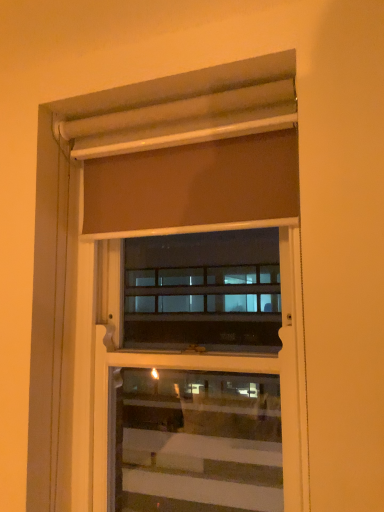
Question: Should I look upward or downward to see matte brown curtain at upper center?

Choices:
 (A) down
 (B) up

Answer: (B)

Question: Can you confirm if matte brown roller shade at upper center is wider than matte brown curtain at upper center?

Choices:
 (A) yes
 (B) no

Answer: (B)

Question: Is matte brown roller shade at upper center surrounding matte brown curtain at upper center?

Choices:
 (A) yes
 (B) no

Answer: (B)

Question: From a real-world perspective, is matte brown roller shade at upper center located higher than matte brown curtain at upper center?

Choices:
 (A) no
 (B) yes

Answer: (A)

Question: From the image's perspective, is matte brown roller shade at upper center above matte brown curtain at upper center?

Choices:
 (A) yes
 (B) no

Answer: (B)

Question: Does matte brown roller shade at upper center have a lesser width compared to matte brown curtain at upper center?

Choices:
 (A) no
 (B) yes

Answer: (B)

Question: Is matte brown roller shade at upper center facing towards matte brown curtain at upper center?

Choices:
 (A) yes
 (B) no

Answer: (A)

Question: Considering the relative sizes of matte brown curtain at upper center and matte brown roller shade at upper center in the image provided, is matte brown curtain at upper center thinner than matte brown roller shade at upper center?

Choices:
 (A) yes
 (B) no

Answer: (B)

Question: Is matte brown curtain at upper center facing towards matte brown roller shade at upper center?

Choices:
 (A) yes
 (B) no

Answer: (B)

Question: Is matte brown curtain at upper center smaller than matte brown roller shade at upper center?

Choices:
 (A) no
 (B) yes

Answer: (B)

Question: From the image's perspective, is matte brown curtain at upper center on matte brown roller shade at upper center?

Choices:
 (A) no
 (B) yes

Answer: (B)

Question: Would you say matte brown curtain at upper center contains matte brown roller shade at upper center?

Choices:
 (A) no
 (B) yes

Answer: (A)

Question: Does matte brown curtain at upper center have a larger size compared to matte brown roller shade at upper center?

Choices:
 (A) no
 (B) yes

Answer: (A)

Question: Considering their positions, is matte brown roller shade at upper center located in front of or behind matte brown curtain at upper center?

Choices:
 (A) behind
 (B) front

Answer: (A)